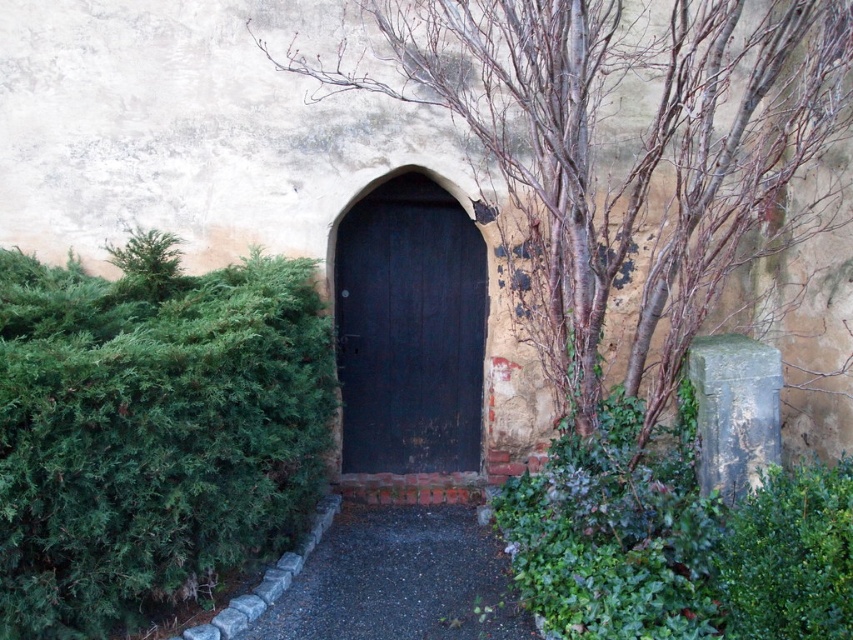
You are standing on the dark gravel path at center and want to reach the green leafy hedge at left. Which direction should you move to get there?

You should move to the left to reach the green leafy hedge at left since it is located to the left of the dark gravel path at center.